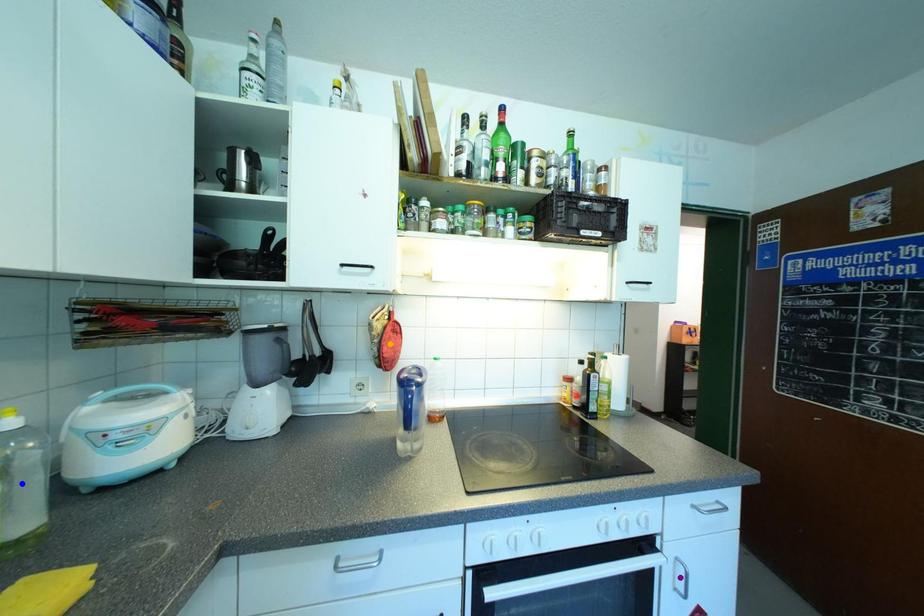
Order these from nearest to farthest:
1. purple point
2. blue point
3. orange point

blue point, purple point, orange point